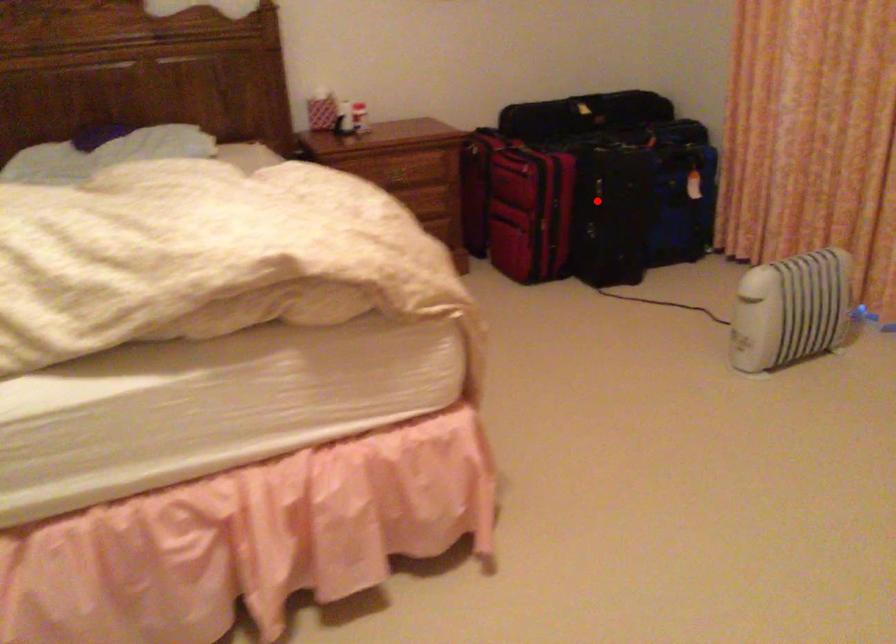
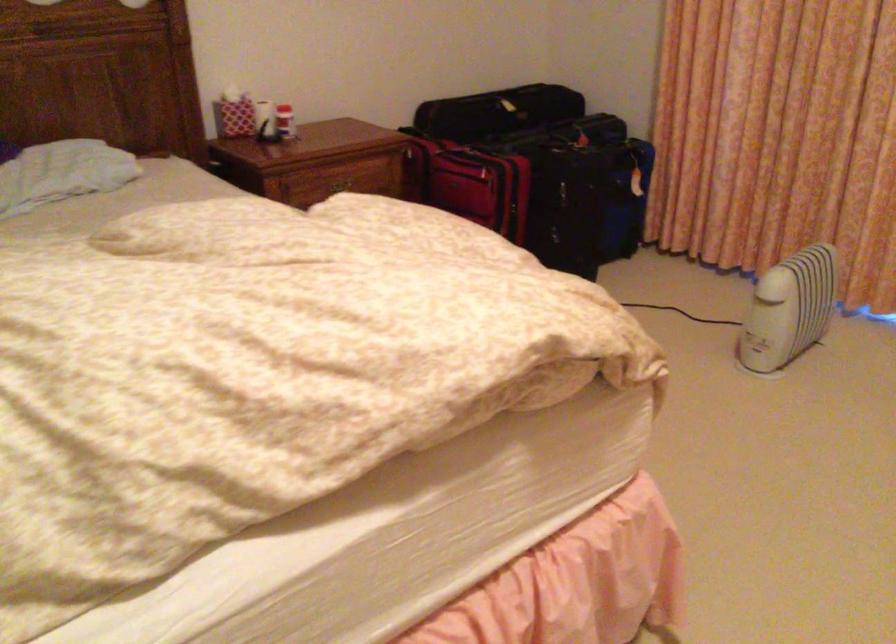
In the second image, find the point that corresponds to the highlighted location in the first image.

(566, 205)